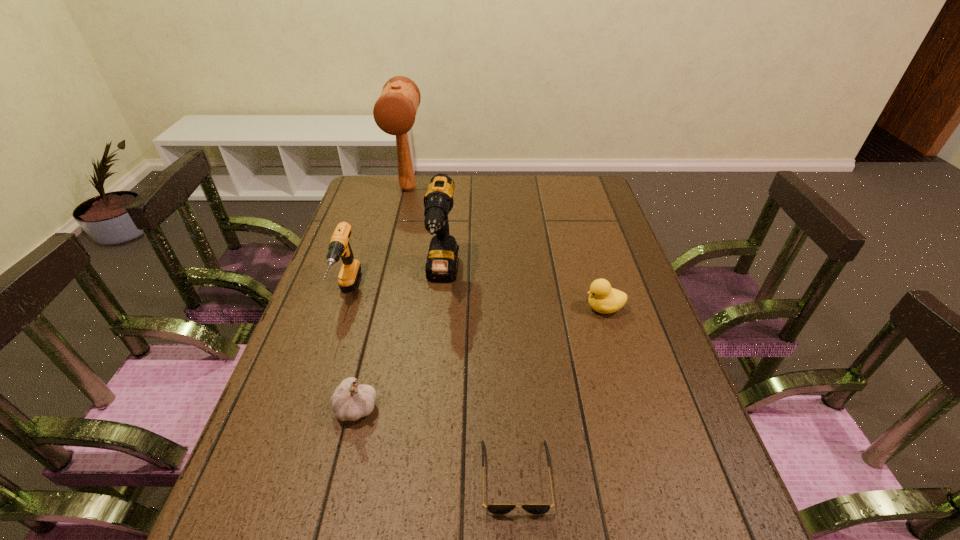
Where is `the closest object relative to the right drill`? the closest object relative to the right drill is located at coordinates (339, 246).

Find the location of `object that ranks as the third closest to the right drill`. object that ranks as the third closest to the right drill is located at coordinates (394, 112).

At what (x,y) coordinates should I click in order to perform the action: click on vacant area that satisfies the following two spatial constraints: 1. on the front-facing side of the rightmost object; 2. on the front side of the fifth farthest object. Please return your answer as a coordinate pair (x, y). Looking at the image, I should click on tap(634, 408).